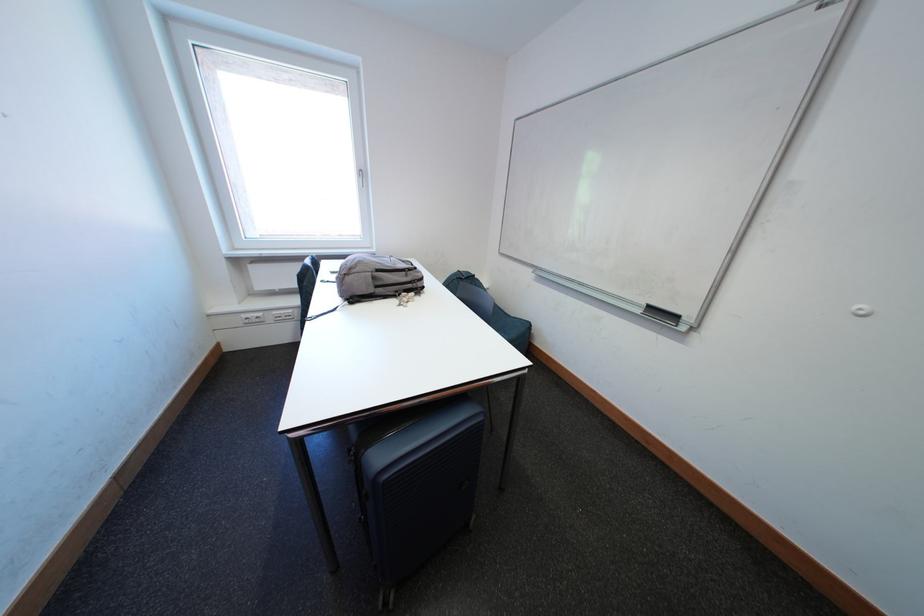
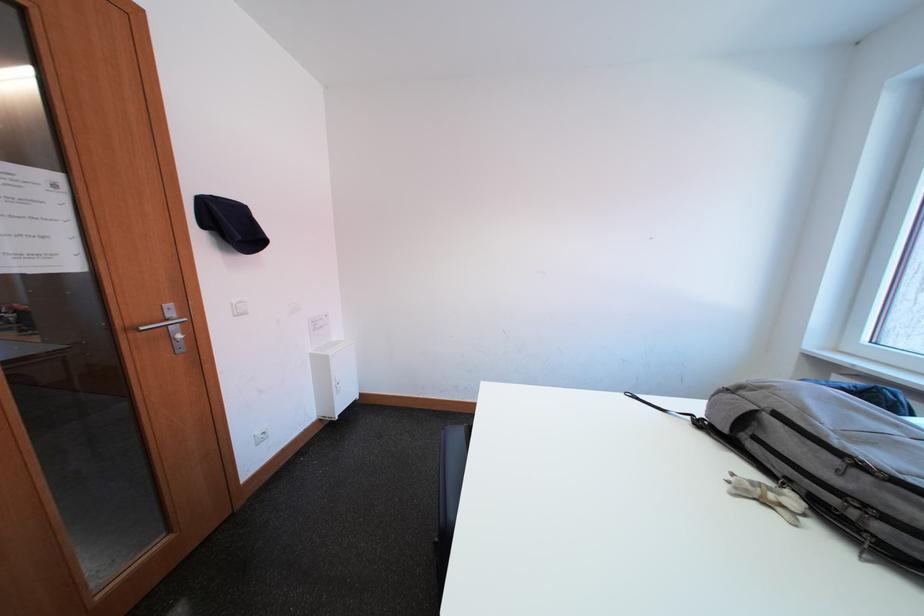
The point at (x=369, y=305) is marked in the first image. Where is the corresponding point in the second image?

(719, 438)